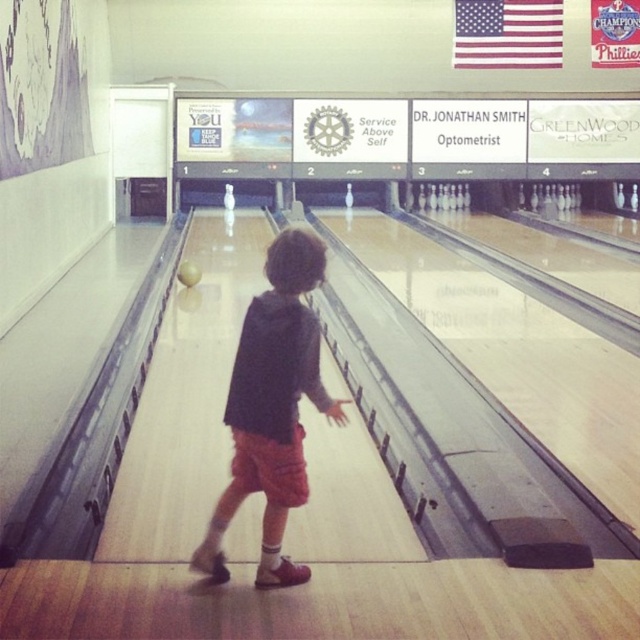
Question: Can you confirm if dark gray hoodie at center is smaller than yellow matte bowling ball at center?

Choices:
 (A) no
 (B) yes

Answer: (A)

Question: Which point appears farthest from the camera in this image?

Choices:
 (A) (179, 268)
 (B) (252, 467)

Answer: (A)

Question: Is dark gray hoodie at center positioned before yellow matte bowling ball at center?

Choices:
 (A) yes
 (B) no

Answer: (A)

Question: Which of the following is the farthest from the observer?

Choices:
 (A) (195, 284)
 (B) (330, 401)

Answer: (A)

Question: Does dark gray hoodie at center appear under yellow matte bowling ball at center?

Choices:
 (A) no
 (B) yes

Answer: (B)